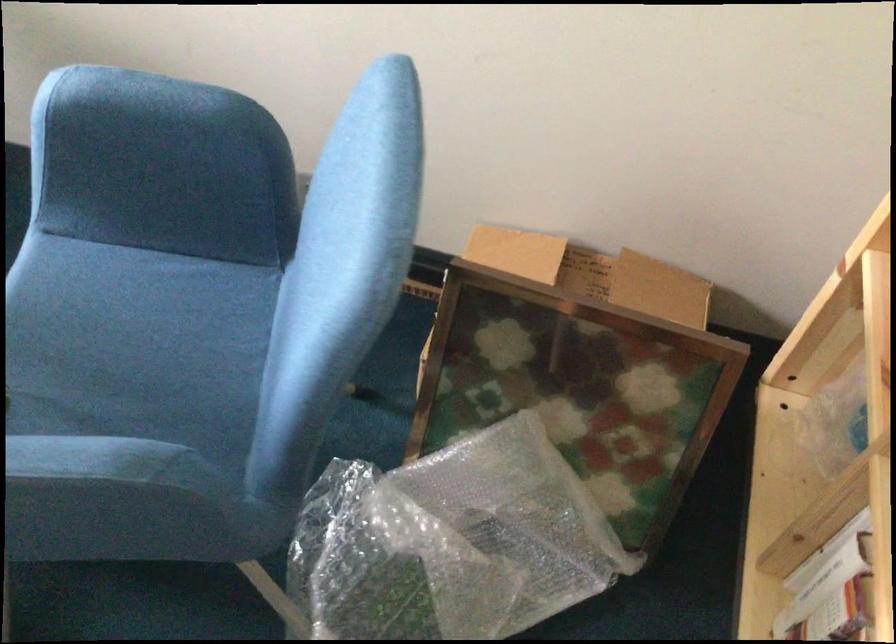
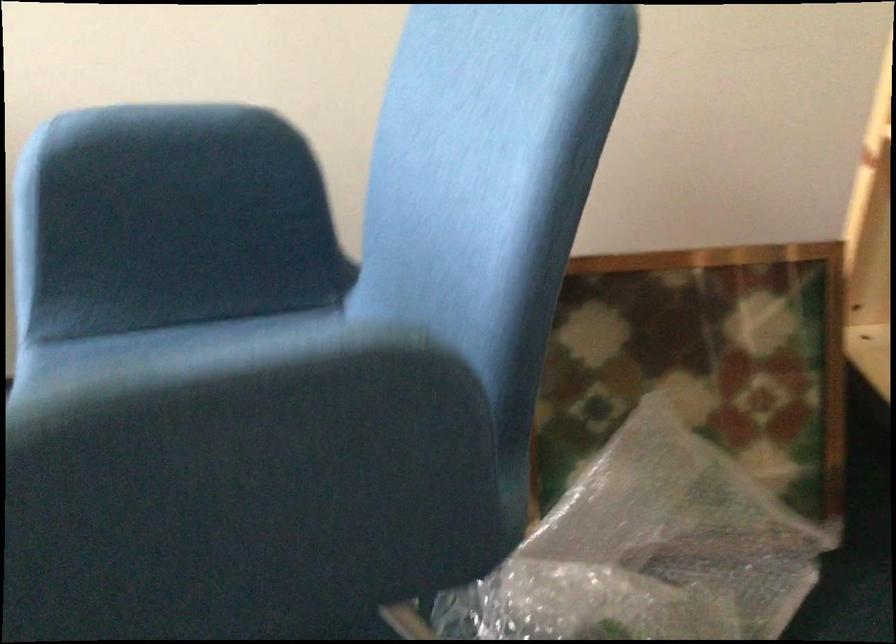
Question: How did the camera likely rotate?

Choices:
 (A) Left
 (B) Right
 (C) Up
 (D) Down

Answer: (C)